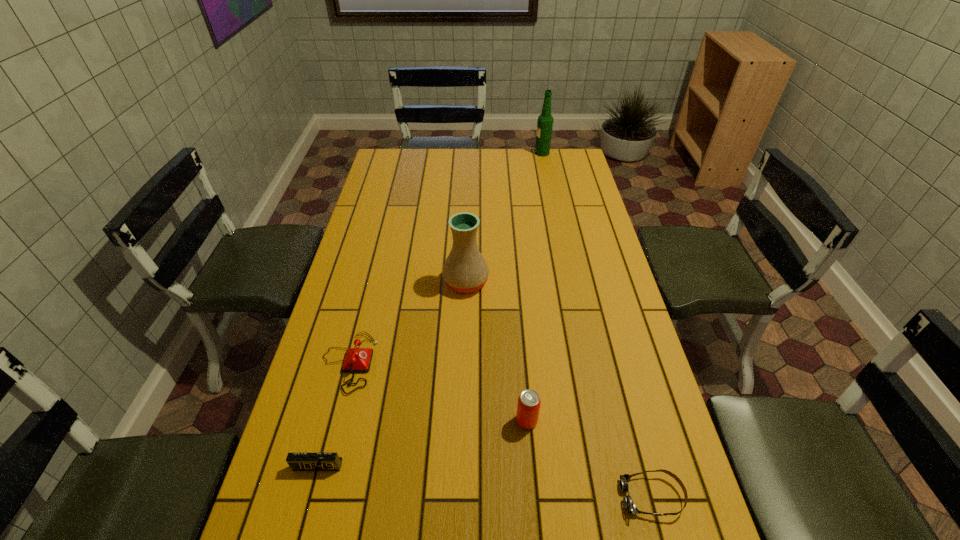
The height and width of the screenshot is (540, 960). What are the coordinates of `object that is at the far edge` in the screenshot? It's located at (545, 121).

What are the coordinates of `telephone that is positioned at the left edge` in the screenshot? It's located at (358, 359).

You are a GUI agent. You are given a task and a screenshot of the screen. Output one action in this format:
    pyautogui.click(x=<x>, y=<y>)
    Task: Click on the alarm clock situated at the left edge
    The image size is (960, 540).
    Given the screenshot: What is the action you would take?
    pyautogui.click(x=297, y=461)

Locate an element on the screen. Image resolution: width=960 pixels, height=540 pixels. beer bottle positioned at the right edge is located at coordinates (545, 121).

Image resolution: width=960 pixels, height=540 pixels. I want to click on goggles located in the right edge section of the desktop, so click(x=629, y=505).

Find the location of a particular element. Image resolution: width=960 pixels, height=540 pixels. object present at the far right corner is located at coordinates (545, 121).

At what (x,y) coordinates should I click in order to perform the action: click on free space at the far edge. Please return your answer as a coordinate pair (x, y). Looking at the image, I should click on (540, 164).

The width and height of the screenshot is (960, 540). I want to click on vacant space at the left edge, so click(332, 440).

The height and width of the screenshot is (540, 960). I want to click on vacant space at the right edge, so click(x=581, y=282).

This screenshot has height=540, width=960. I want to click on blank space at the far right corner of the desktop, so click(552, 169).